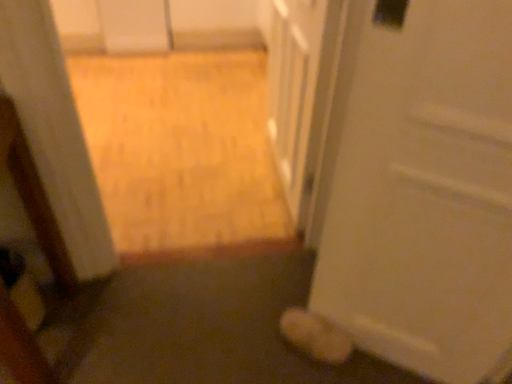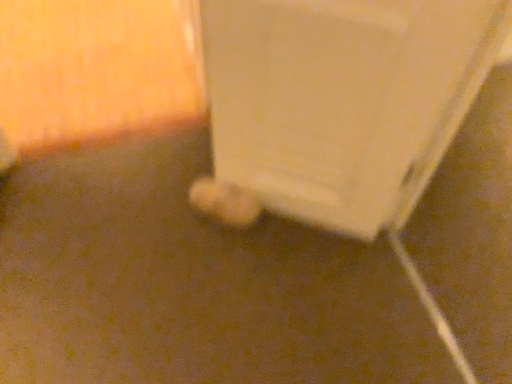
Question: Which way did the camera rotate in the video?

Choices:
 (A) rotated downward
 (B) rotated upward

Answer: (A)